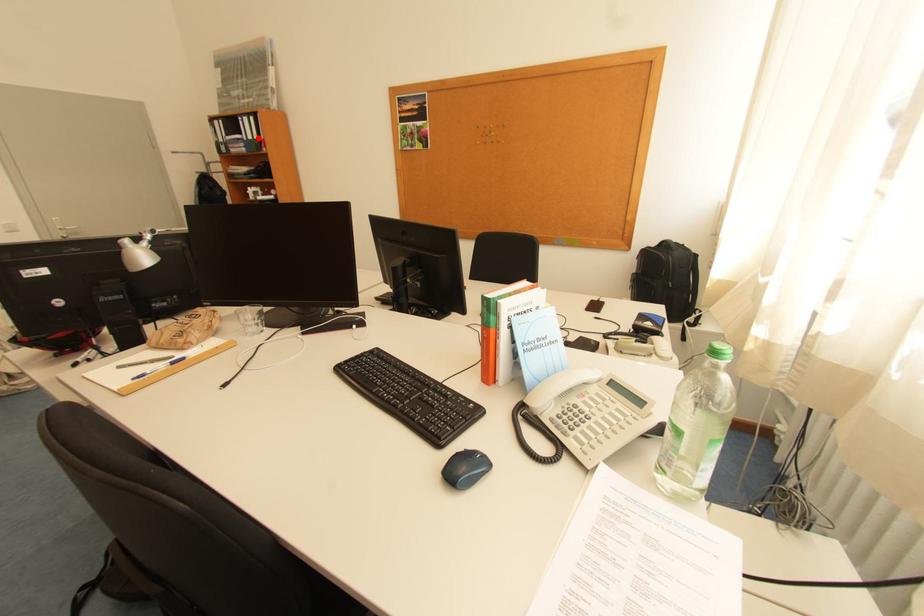
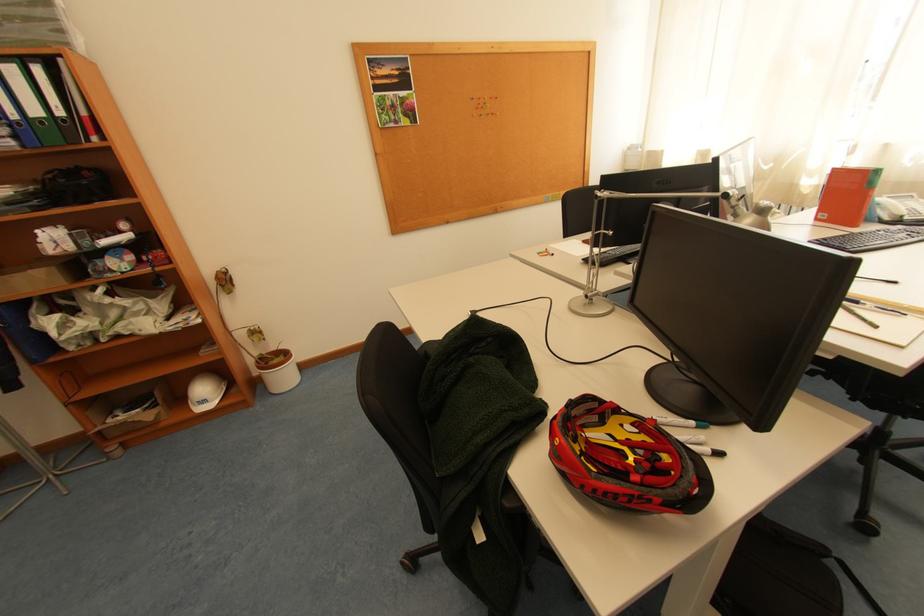
In the second image, find the point that corresponds to the highlighted location in the first image.

(44, 113)